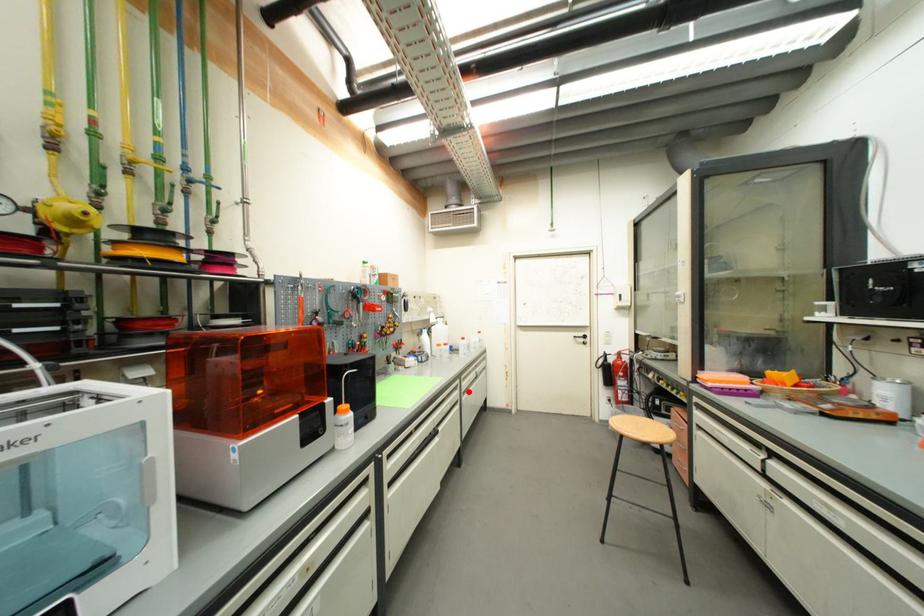
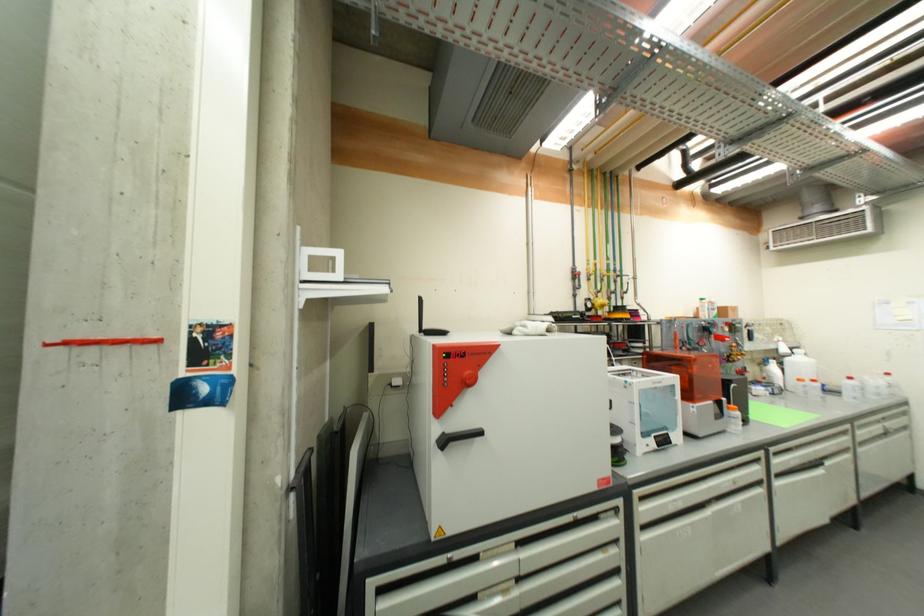
Question: I am providing you with two images of the same scene from different viewpoints. In image1, a red point is highlighted. Considering the same 3D point in image2, which of the following is correct?

Choices:
 (A) It is closer
 (B) It is farther

Answer: (A)